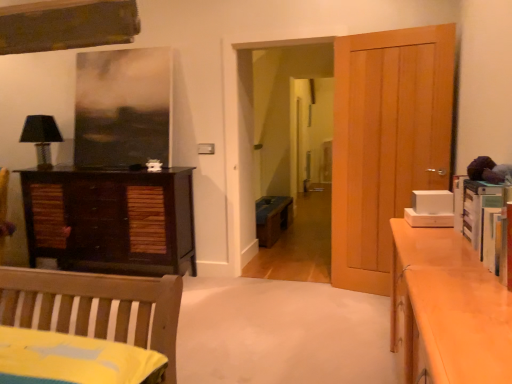
Question: Considering the relative sizes of black fabric lampshade at left and dark wood cabinet at left in the image provided, is black fabric lampshade at left shorter than dark wood cabinet at left?

Choices:
 (A) yes
 (B) no

Answer: (A)

Question: Is black fabric lampshade at left taller than dark wood cabinet at left?

Choices:
 (A) yes
 (B) no

Answer: (B)

Question: Is black fabric lampshade at left aimed at dark wood cabinet at left?

Choices:
 (A) no
 (B) yes

Answer: (A)

Question: Can you confirm if black fabric lampshade at left is thinner than dark wood cabinet at left?

Choices:
 (A) no
 (B) yes

Answer: (B)

Question: From the image's perspective, is black fabric lampshade at left beneath dark wood cabinet at left?

Choices:
 (A) yes
 (B) no

Answer: (B)

Question: Is light brown wooden door at right bigger or smaller than wooden bench at center?

Choices:
 (A) big
 (B) small

Answer: (B)

Question: Considering their positions, is light brown wooden door at right located in front of or behind wooden bench at center?

Choices:
 (A) front
 (B) behind

Answer: (A)

Question: From the image's perspective, relative to wooden bench at center, is light brown wooden door at right above or below?

Choices:
 (A) below
 (B) above

Answer: (B)

Question: From a real-world perspective, is light brown wooden door at right positioned above or below wooden bench at center?

Choices:
 (A) above
 (B) below

Answer: (A)

Question: From their relative heights in the image, would you say light brown wooden door at right is taller or shorter than dark wood cabinet at left?

Choices:
 (A) short
 (B) tall

Answer: (B)

Question: Is light brown wooden door at right in front of or behind dark wood cabinet at left in the image?

Choices:
 (A) behind
 (B) front

Answer: (B)

Question: Considering the positions of light brown wooden door at right and dark wood cabinet at left in the image, is light brown wooden door at right wider or thinner than dark wood cabinet at left?

Choices:
 (A) thin
 (B) wide

Answer: (A)

Question: From the image's perspective, is light brown wooden door at right located above or below dark wood cabinet at left?

Choices:
 (A) above
 (B) below

Answer: (A)

Question: From a real-world perspective, is dark wood cabinet at left physically located above or below black fabric lampshade at left?

Choices:
 (A) below
 (B) above

Answer: (A)

Question: Would you say dark wood cabinet at left is inside or outside black fabric lampshade at left?

Choices:
 (A) outside
 (B) inside

Answer: (A)